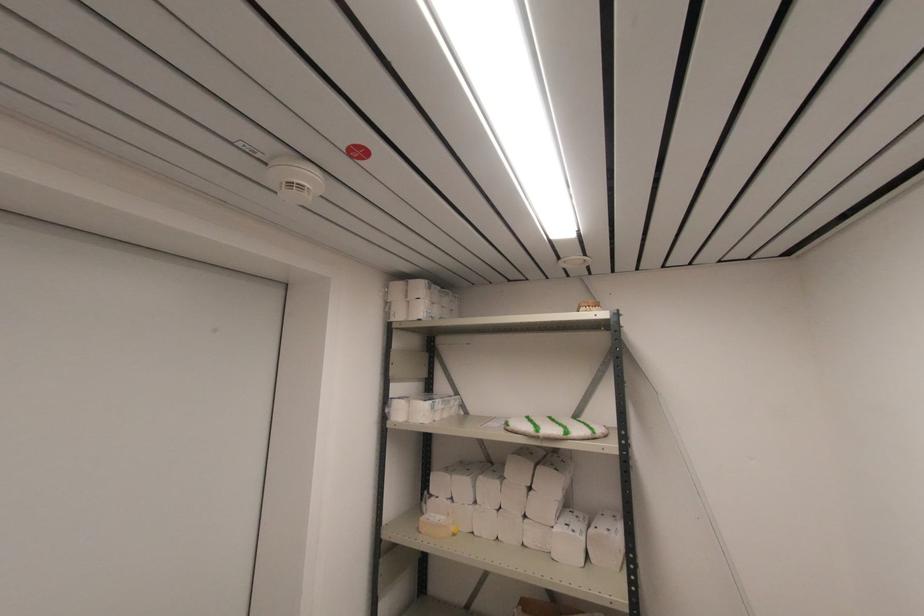
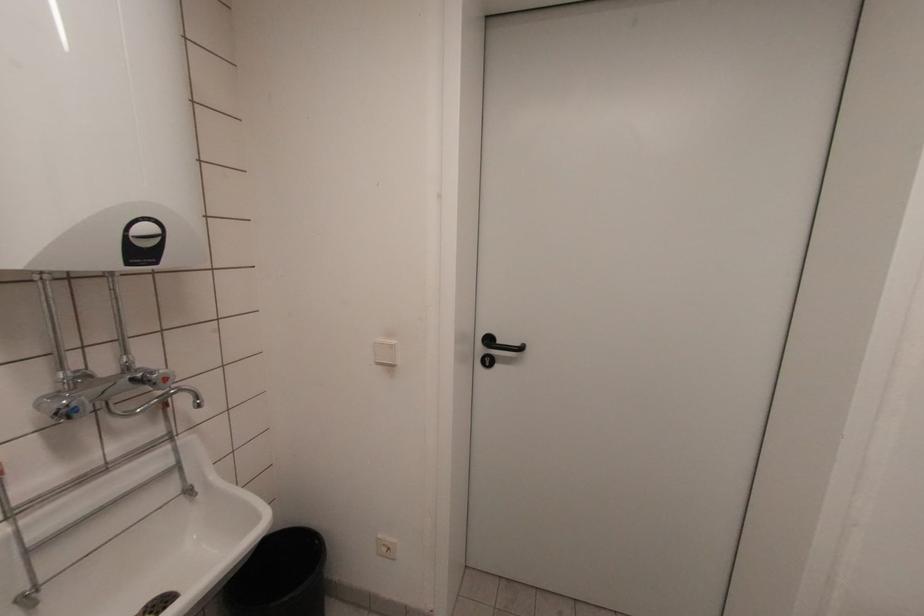
Question: The camera is either moving clockwise (left) or counter-clockwise (right) around the object. The first image is from the beginning of the video and the second image is from the end. Is the camera moving left or right when shooting the video?

Choices:
 (A) Left
 (B) Right

Answer: (B)